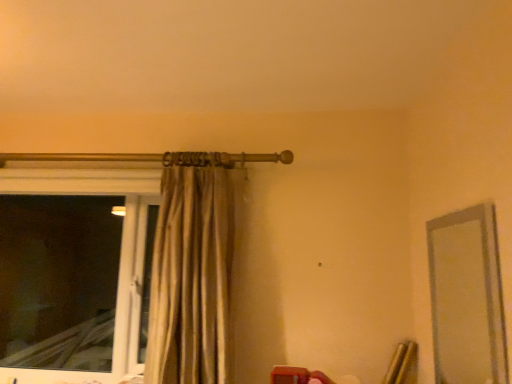
What do you see at coordinates (73, 273) in the screenshot?
I see `transparent glass window at left` at bounding box center [73, 273].

At what (x,y) coordinates should I click in order to perform the action: click on transparent glass window at left. Please return your answer as a coordinate pair (x, y). Image resolution: width=512 pixels, height=384 pixels. Looking at the image, I should click on (73, 273).

From the image's perspective, which is below, transparent glass window at left or clear glass mirror at right?

transparent glass window at left is shown below in the image.

Find the location of a particular element. mirror lying in front of the transparent glass window at left is located at coordinates (467, 298).

Are transparent glass window at left and clear glass mirror at right beside each other?

transparent glass window at left and clear glass mirror at right are not in contact.

Are transparent glass window at left and beige fabric curtain at upper center beside each other?

transparent glass window at left and beige fabric curtain at upper center are not in contact.

Is transparent glass window at left facing towards beige fabric curtain at upper center?

No, transparent glass window at left is not facing towards beige fabric curtain at upper center.

Is transparent glass window at left bigger than beige fabric curtain at upper center?

Actually, transparent glass window at left might be smaller than beige fabric curtain at upper center.

Locate an element on the screen. window on the left of beige fabric curtain at upper center is located at coordinates (73, 273).

Can you confirm if clear glass mirror at right is wider than beige fabric curtain at upper center?

No.

How distant is clear glass mirror at right from beige fabric curtain at upper center?

clear glass mirror at right is 37.02 inches away from beige fabric curtain at upper center.

Is clear glass mirror at right oriented away from beige fabric curtain at upper center?

clear glass mirror at right does not have its back to beige fabric curtain at upper center.

From the image's perspective, which one is positioned lower, beige fabric curtain at upper center or transparent glass window at left?

transparent glass window at left.

Locate an element on the screen. The width and height of the screenshot is (512, 384). curtain that is in front of the transparent glass window at left is located at coordinates (192, 271).

Considering the sizes of objects beige fabric curtain at upper center and transparent glass window at left in the image provided, who is shorter, beige fabric curtain at upper center or transparent glass window at left?

transparent glass window at left.

Could you tell me if beige fabric curtain at upper center is turned towards clear glass mirror at right?

No, beige fabric curtain at upper center does not turn towards clear glass mirror at right.

Between beige fabric curtain at upper center and clear glass mirror at right, which one is positioned behind?

beige fabric curtain at upper center is further away from the camera.

From the image's perspective, is beige fabric curtain at upper center located beneath clear glass mirror at right?

No.

From a real-world perspective, who is located higher, beige fabric curtain at upper center or clear glass mirror at right?

beige fabric curtain at upper center, from a real-world perspective.

What's the angular difference between clear glass mirror at right and transparent glass window at left's facing directions?

They differ by 89.4 degrees in their facing directions.

From a real-world perspective, is clear glass mirror at right on top of transparent glass window at left?

Yes, from a real-world perspective, clear glass mirror at right is over transparent glass window at left

How far apart are clear glass mirror at right and transparent glass window at left?

A distance of 7.73 feet exists between clear glass mirror at right and transparent glass window at left.

Considering the relative positions of clear glass mirror at right and transparent glass window at left in the image provided, is clear glass mirror at right in front of transparent glass window at left?

Yes.

Find the location of `window on the left of clear glass mirror at right`. window on the left of clear glass mirror at right is located at coordinates (73, 273).

You are a GUI agent. You are given a task and a screenshot of the screen. Output one action in this format:
    pyautogui.click(x=<x>, y=<y>)
    Task: Click on the curtain on the right of the transparent glass window at left
    
    Given the screenshot: What is the action you would take?
    pyautogui.click(x=192, y=271)

Estimate the real-world distances between objects in this image. Which object is further from beige fabric curtain at upper center, clear glass mirror at right or transparent glass window at left?

The object further to beige fabric curtain at upper center is transparent glass window at left.

Which object lies nearer to the anchor point transparent glass window at left, beige fabric curtain at upper center or clear glass mirror at right?

Based on the image, beige fabric curtain at upper center appears to be nearer to transparent glass window at left.

Considering their positions, is transparent glass window at left positioned closer to beige fabric curtain at upper center than clear glass mirror at right?

The object closer to beige fabric curtain at upper center is clear glass mirror at right.

Considering their positions, is clear glass mirror at right positioned closer to transparent glass window at left than beige fabric curtain at upper center?

Based on the image, beige fabric curtain at upper center appears to be nearer to transparent glass window at left.

Estimate the real-world distances between objects in this image. Which object is further from clear glass mirror at right, beige fabric curtain at upper center or transparent glass window at left?

transparent glass window at left is further to clear glass mirror at right.

Estimate the real-world distances between objects in this image. Which object is further from clear glass mirror at right, transparent glass window at left or beige fabric curtain at upper center?

transparent glass window at left.

Locate an element on the screen. The width and height of the screenshot is (512, 384). curtain between transparent glass window at left and clear glass mirror at right from left to right is located at coordinates (192, 271).